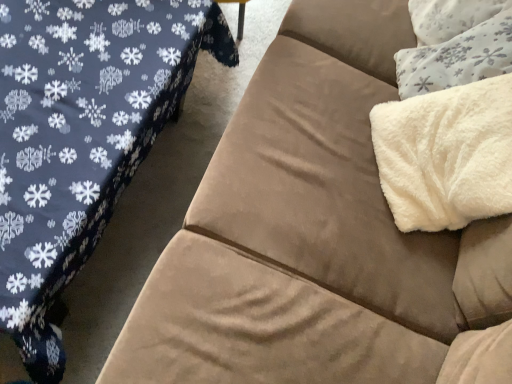
In order to click on suede couch at right in this screenshot , I will do `click(81, 136)`.

Identify the location of white fluffy blanket at upper right. (x=446, y=155).

This screenshot has width=512, height=384. I want to click on white fluffy throw pillow at upper right, so click(x=455, y=45).

Identify the location of suede couch at right. (81, 136).

From the image's perspective, which is above, white fluffy blanket at upper right or suede couch at right?

suede couch at right, from the image's perspective.

Between white fluffy blanket at upper right and suede couch at right, which one appears on the right side from the viewer's perspective?

white fluffy blanket at upper right is more to the right.

Can you confirm if white fluffy blanket at upper right is smaller than suede couch at right?

Indeed, white fluffy blanket at upper right has a smaller size compared to suede couch at right.

Which is nearer, (402, 230) or (42, 329)?

The point (42, 329) is in front.

Can you tell me how much white fluffy blanket at upper right and white fluffy throw pillow at upper right differ in facing direction?

2.1 degrees separate the facing orientations of white fluffy blanket at upper right and white fluffy throw pillow at upper right.

Is white fluffy blanket at upper right in contact with white fluffy throw pillow at upper right?

No, white fluffy blanket at upper right is not next to white fluffy throw pillow at upper right.

Is point (438, 190) closer or farther from the camera than point (448, 87)?

Point (438, 190) is positioned closer to the camera compared to point (448, 87).

Which of these two, white fluffy throw pillow at upper right or suede couch at right, is smaller?

Smaller between the two is white fluffy throw pillow at upper right.

Identify the location of studio couch directly beneath the white fluffy throw pillow at upper right (from a real-world perspective). Image resolution: width=512 pixels, height=384 pixels. (81, 136).

From a real-world perspective, is white fluffy throw pillow at upper right positioned above or below suede couch at right?

Clearly, from a real-world perspective, white fluffy throw pillow at upper right is above suede couch at right.

Is point (142, 14) in front of point (422, 120)?

That is True.

Are suede couch at right and white fluffy blanket at upper right far apart?

No.

Is suede couch at right located outside white fluffy blanket at upper right?

suede couch at right lies outside white fluffy blanket at upper right's area.

Can you confirm if suede couch at right is bigger than white fluffy blanket at upper right?

Correct, suede couch at right is larger in size than white fluffy blanket at upper right.

Between suede couch at right and white fluffy throw pillow at upper right, which one has more height?

With more height is white fluffy throw pillow at upper right.

Does suede couch at right have a greater width compared to white fluffy throw pillow at upper right?

Yes.

From a real-world perspective, is suede couch at right physically above white fluffy throw pillow at upper right?

No, from a real-world perspective, suede couch at right is not above white fluffy throw pillow at upper right.

Considering the relative positions of suede couch at right and white fluffy throw pillow at upper right in the image provided, is suede couch at right behind white fluffy throw pillow at upper right?

No.

Which of these two, white fluffy throw pillow at upper right or white fluffy blanket at upper right, is bigger?

Bigger between the two is white fluffy blanket at upper right.

Where is `blanket on the left of white fluffy throw pillow at upper right`? The height and width of the screenshot is (384, 512). blanket on the left of white fluffy throw pillow at upper right is located at coordinates (446, 155).

Considering the positions of objects white fluffy throw pillow at upper right and white fluffy blanket at upper right in the image provided, who is in front, white fluffy throw pillow at upper right or white fluffy blanket at upper right?

Positioned in front is white fluffy blanket at upper right.

The height and width of the screenshot is (384, 512). What are the coordinates of `blanket above the suede couch at right (from a real-world perspective)` in the screenshot? It's located at (446, 155).

The height and width of the screenshot is (384, 512). Identify the location of blanket below the white fluffy throw pillow at upper right (from the image's perspective). (446, 155).

Looking at this image, based on their spatial positions, is white fluffy blanket at upper right or white fluffy throw pillow at upper right closer to suede couch at right?

The object closer to suede couch at right is white fluffy blanket at upper right.

Based on their spatial positions, is white fluffy throw pillow at upper right or suede couch at right closer to white fluffy blanket at upper right?

white fluffy throw pillow at upper right.

Looking at the image, which one is located further to white fluffy throw pillow at upper right, suede couch at right or white fluffy blanket at upper right?

suede couch at right lies further to white fluffy throw pillow at upper right than the other object.

Based on their spatial positions, is white fluffy blanket at upper right or suede couch at right closer to white fluffy throw pillow at upper right?

The object closer to white fluffy throw pillow at upper right is white fluffy blanket at upper right.

From the image, which object appears to be nearer to suede couch at right, white fluffy throw pillow at upper right or white fluffy blanket at upper right?

white fluffy blanket at upper right is positioned closer to the anchor suede couch at right.

Which object lies nearer to the anchor point white fluffy blanket at upper right, suede couch at right or white fluffy throw pillow at upper right?

white fluffy throw pillow at upper right lies closer to white fluffy blanket at upper right than the other object.

Locate an element on the screen. blanket between suede couch at right and white fluffy throw pillow at upper right is located at coordinates (446, 155).